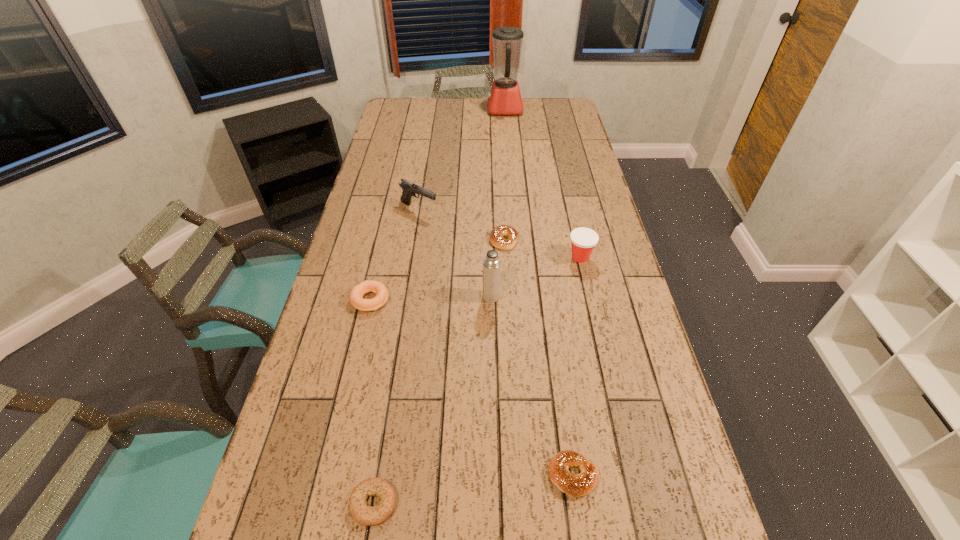
Where is `the rightmost bagel`? the rightmost bagel is located at coordinates (582, 484).

You are a GUI agent. You are given a task and a screenshot of the screen. Output one action in this format:
    pyautogui.click(x=<x>, y=<y>)
    Task: Click on the vacant space located on the front of the farthest object near the controls
    Image resolution: width=960 pixels, height=540 pixels.
    Given the screenshot: What is the action you would take?
    pyautogui.click(x=431, y=110)

You are a GUI agent. You are given a task and a screenshot of the screen. Output one action in this format:
    pyautogui.click(x=<x>, y=<y>)
    Task: Click on the free region located on the front of the farthest object near the controls
    
    Given the screenshot: What is the action you would take?
    pyautogui.click(x=443, y=110)

The width and height of the screenshot is (960, 540). In order to click on vacant space located 0.090m on the front of the farthest object near the controls in this screenshot , I will do `click(468, 110)`.

At what (x,y) coordinates should I click in order to perform the action: click on vacant space located on the left of the second tallest object. Please return your answer as a coordinate pair (x, y). This screenshot has width=960, height=540. Looking at the image, I should click on (377, 296).

Locate an element on the screen. This screenshot has height=540, width=960. free location located at the muzzle of the third tallest object is located at coordinates (495, 210).

Find the location of a particular element. The width and height of the screenshot is (960, 540). free region located on the front of the rightmost object is located at coordinates (606, 368).

Locate an element on the screen. The height and width of the screenshot is (540, 960). vacant space located on the back of the fifth tallest object is located at coordinates (387, 228).

You are a GUI agent. You are given a task and a screenshot of the screen. Output one action in this format:
    pyautogui.click(x=<x>, y=<y>)
    Task: Click on the free region located 0.090m on the left of the farthest bagel
    
    Given the screenshot: What is the action you would take?
    pyautogui.click(x=463, y=240)

Locate an element on the screen. The width and height of the screenshot is (960, 540). free space located 0.100m on the right of the rightmost bagel is located at coordinates coord(643,475).